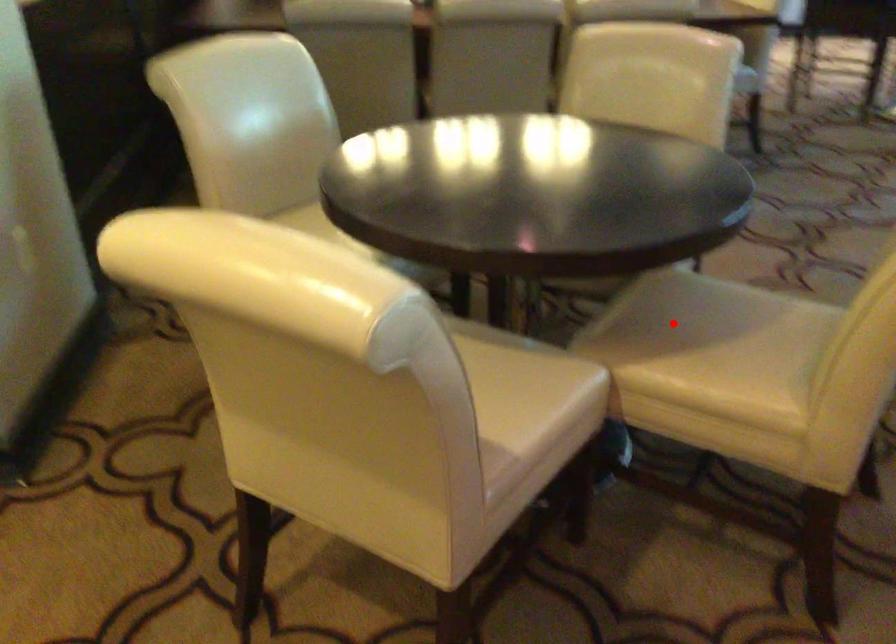
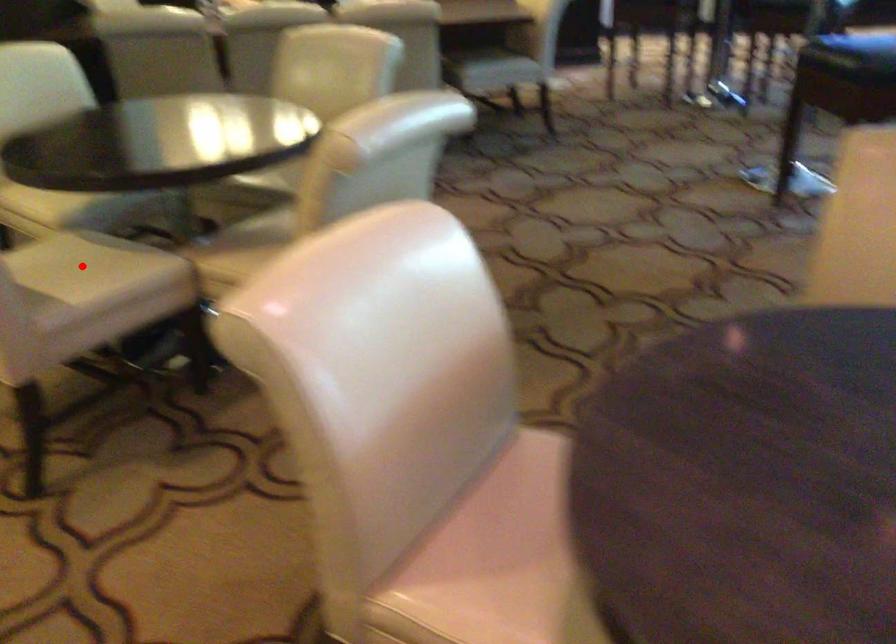
I am providing you with two images of the same scene from different viewpoints. A red point is marked on the first image and another point is marked on the second image. Does the point marked in image1 correspond to the same location as the one in image2?

No